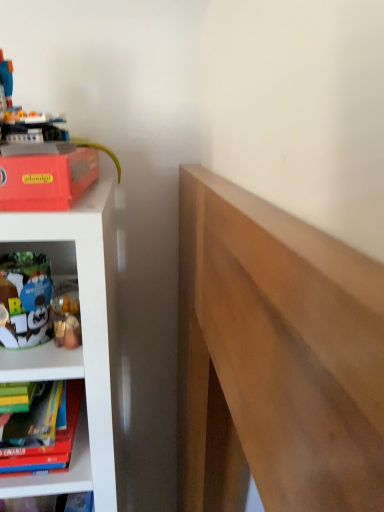
Question: From a real-world perspective, is white plush toy at lower left, which is counted as the 1th toy, starting from the bottom, under matte red paperback book at upper left?

Choices:
 (A) yes
 (B) no

Answer: (A)

Question: Considering the relative positions of white plush toy at lower left, the 2th toy from the top, and matte red paperback book at upper left in the image provided, is white plush toy at lower left, the 2th toy from the top, in front of matte red paperback book at upper left?

Choices:
 (A) no
 (B) yes

Answer: (A)

Question: From the image's perspective, is white plush toy at lower left, the 2th toy from the top, beneath matte red paperback book at upper left?

Choices:
 (A) yes
 (B) no

Answer: (A)

Question: Does white plush toy at lower left, which is counted as the 1th toy, starting from the bottom, have a lesser width compared to matte red paperback book at upper left?

Choices:
 (A) yes
 (B) no

Answer: (A)

Question: Is white plush toy at lower left, which is counted as the 1th toy, starting from the bottom, at the right side of matte red paperback book at upper left?

Choices:
 (A) no
 (B) yes

Answer: (B)

Question: Is white plush toy at lower left, which is counted as the 1th toy, starting from the bottom, far from matte red paperback book at upper left?

Choices:
 (A) no
 (B) yes

Answer: (A)

Question: Does matte red paperback book at upper left have a smaller size compared to plastic toy robot at upper left, arranged as the first toy when viewed from the top?

Choices:
 (A) no
 (B) yes

Answer: (B)

Question: From a real-world perspective, does matte red paperback book at upper left stand above plastic toy robot at upper left, arranged as the first toy when viewed from the top?

Choices:
 (A) yes
 (B) no

Answer: (B)

Question: Does matte red paperback book at upper left have a lesser height compared to plastic toy robot at upper left, the 2th toy in the bottom-to-top sequence?

Choices:
 (A) no
 (B) yes

Answer: (B)

Question: Is matte red paperback book at upper left oriented towards plastic toy robot at upper left, the 2th toy in the bottom-to-top sequence?

Choices:
 (A) no
 (B) yes

Answer: (A)

Question: Can you confirm if matte red paperback book at upper left is taller than plastic toy robot at upper left, arranged as the first toy when viewed from the top?

Choices:
 (A) no
 (B) yes

Answer: (A)

Question: From the image's perspective, is matte red paperback book at upper left over plastic toy robot at upper left, the 2th toy in the bottom-to-top sequence?

Choices:
 (A) yes
 (B) no

Answer: (B)

Question: Does plastic toy robot at upper left, arranged as the first toy when viewed from the top, have a smaller size compared to matte red paperback book at upper left?

Choices:
 (A) yes
 (B) no

Answer: (B)